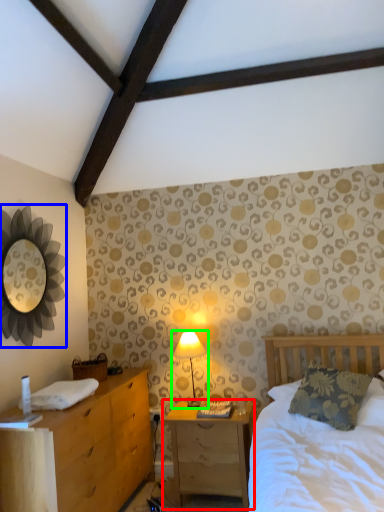
Question: Estimate the real-world distances between objects in this image. Which object is farther from nightstand (highlighted by a red box), mirror (highlighted by a blue box) or table lamp (highlighted by a green box)?

Choices:
 (A) mirror
 (B) table lamp

Answer: (A)